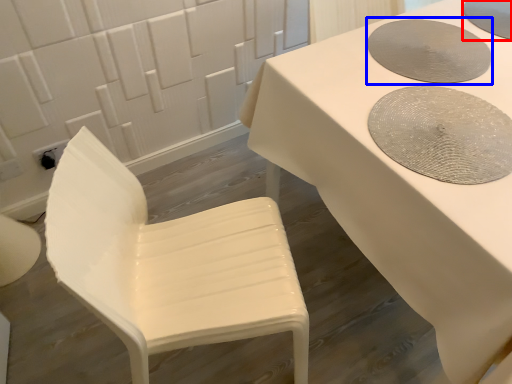
Question: Among these objects, which one is farthest to the camera, manhole cover (highlighted by a red box) or manhole cover (highlighted by a blue box)?

Choices:
 (A) manhole cover
 (B) manhole cover

Answer: (A)